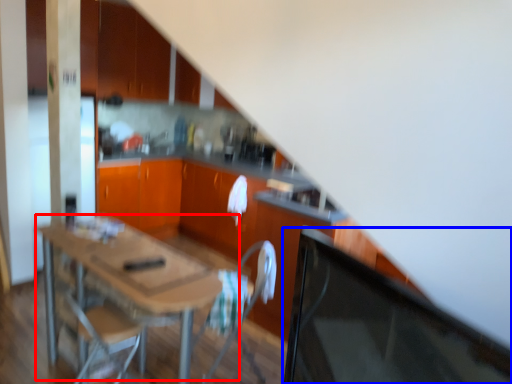
Question: Which object appears closest to the camera in this image, table (highlighted by a red box) or computer monitor (highlighted by a blue box)?

Choices:
 (A) table
 (B) computer monitor

Answer: (B)